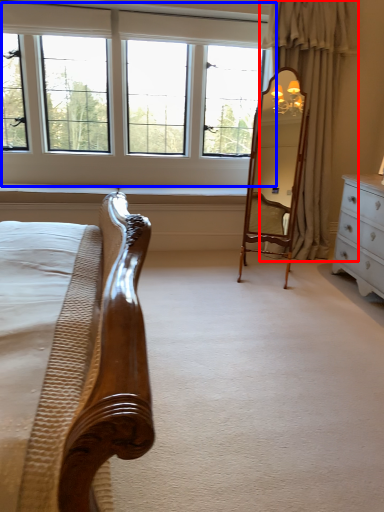
Question: Which object is closer to the camera taking this photo, curtain (highlighted by a red box) or window (highlighted by a blue box)?

Choices:
 (A) curtain
 (B) window

Answer: (A)